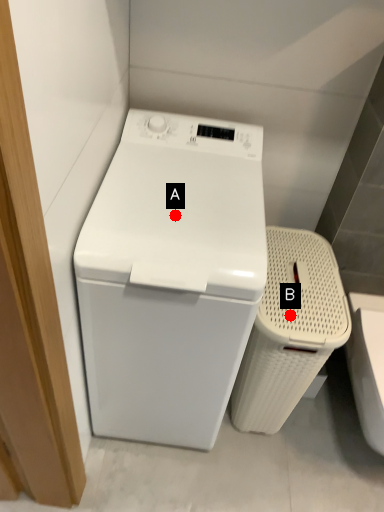
Question: Two points are circled on the image, labeled by A and B beside each circle. Among these points, which one is nearest to the camera?

Choices:
 (A) A is closer
 (B) B is closer

Answer: (A)